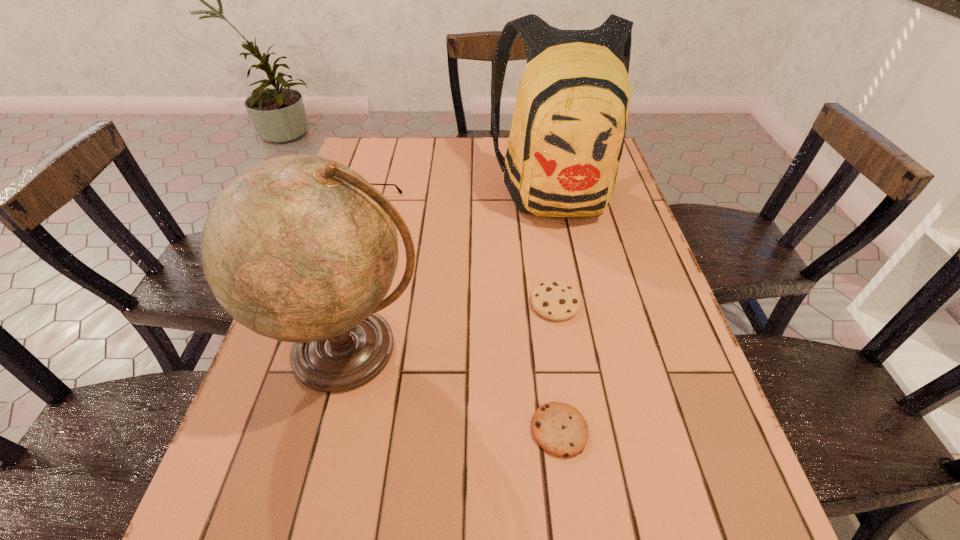
At what (x,y) coordinates should I click in order to perform the action: click on the third closest object to the backpack. Please return your answer as a coordinate pair (x, y). Looking at the image, I should click on click(x=299, y=248).